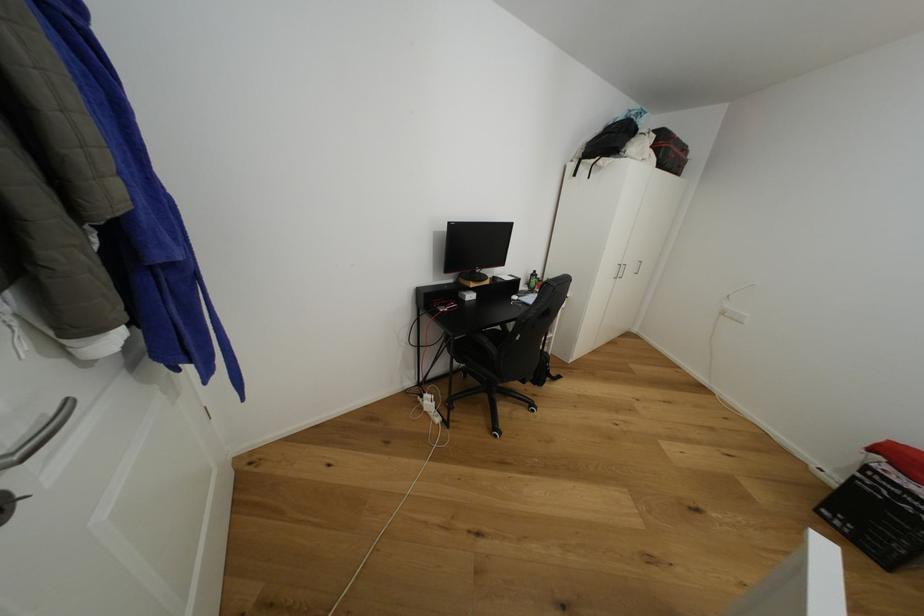
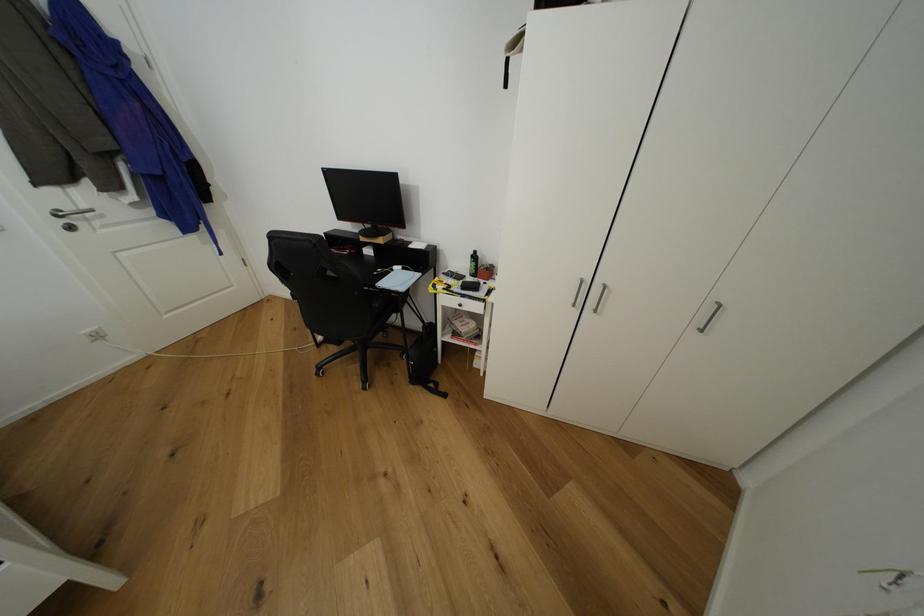
The point at [537,277] is marked in the first image. Where is the corresponding point in the second image?

(478, 257)